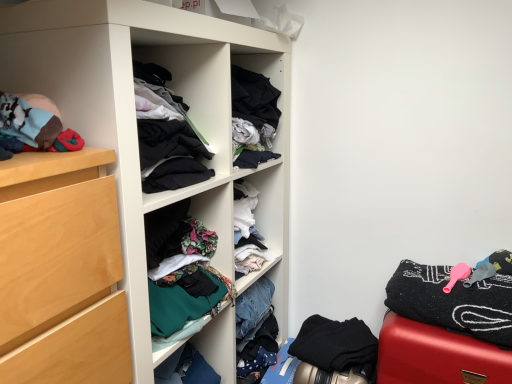
Question: Does smooth red suitcase at lower right have a greater height compared to black matte fabric at lower right, arranged as the second clothing when viewed from the top?

Choices:
 (A) no
 (B) yes

Answer: (B)

Question: Is smooth red suitcase at lower right behind black matte fabric at lower right, which is the first clothing in bottom-to-top order?

Choices:
 (A) no
 (B) yes

Answer: (A)

Question: Does smooth red suitcase at lower right appear on the left side of black matte fabric at lower right, which is the first clothing in bottom-to-top order?

Choices:
 (A) no
 (B) yes

Answer: (A)

Question: Is smooth red suitcase at lower right located outside black matte fabric at lower right, arranged as the second clothing when viewed from the top?

Choices:
 (A) yes
 (B) no

Answer: (A)

Question: From the image's perspective, is smooth red suitcase at lower right under black matte fabric at lower right, arranged as the second clothing when viewed from the top?

Choices:
 (A) yes
 (B) no

Answer: (B)

Question: Is black matte fabric at lower right, which is the first clothing in bottom-to-top order, in front of or behind matte white cupboard at center in the image?

Choices:
 (A) front
 (B) behind

Answer: (B)

Question: Would you say black matte fabric at lower right, arranged as the second clothing when viewed from the top, is inside or outside matte white cupboard at center?

Choices:
 (A) outside
 (B) inside

Answer: (A)

Question: Is point (301, 357) positioned closer to the camera than point (148, 13)?

Choices:
 (A) farther
 (B) closer

Answer: (A)

Question: Is black matte fabric at lower right, which is the first clothing in bottom-to-top order, wider or thinner than matte white cupboard at center?

Choices:
 (A) thin
 (B) wide

Answer: (A)

Question: Does point (134, 369) appear closer or farther from the camera than point (403, 377)?

Choices:
 (A) closer
 (B) farther

Answer: (A)

Question: Which is correct: matte white cupboard at center is inside smooth red suitcase at lower right, or outside of it?

Choices:
 (A) inside
 (B) outside

Answer: (B)

Question: Considering the positions of matte white cupboard at center and smooth red suitcase at lower right in the image, is matte white cupboard at center taller or shorter than smooth red suitcase at lower right?

Choices:
 (A) tall
 (B) short

Answer: (A)

Question: Is matte white cupboard at center wider or thinner than smooth red suitcase at lower right?

Choices:
 (A) thin
 (B) wide

Answer: (B)

Question: Is smooth red suitcase at lower right to the left or to the right of black matte fabric at lower right, arranged as the second clothing when viewed from the top, in the image?

Choices:
 (A) right
 (B) left

Answer: (A)

Question: Considering their positions, is smooth red suitcase at lower right located in front of or behind black matte fabric at lower right, arranged as the second clothing when viewed from the top?

Choices:
 (A) behind
 (B) front

Answer: (B)